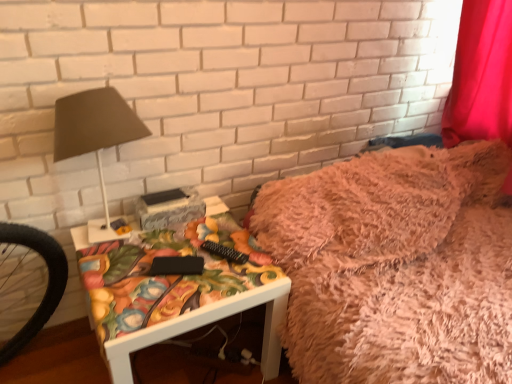
Question: Considering the relative positions of matte brown lampshade at left and fuzzy pink blanket at upper right in the image provided, is matte brown lampshade at left to the left of fuzzy pink blanket at upper right from the viewer's perspective?

Choices:
 (A) no
 (B) yes

Answer: (B)

Question: Considering the relative sizes of matte brown lampshade at left and fuzzy pink blanket at upper right in the image provided, is matte brown lampshade at left thinner than fuzzy pink blanket at upper right?

Choices:
 (A) no
 (B) yes

Answer: (B)

Question: Does matte brown lampshade at left appear on the right side of fuzzy pink blanket at upper right?

Choices:
 (A) yes
 (B) no

Answer: (B)

Question: Is matte brown lampshade at left shorter than fuzzy pink blanket at upper right?

Choices:
 (A) yes
 (B) no

Answer: (B)

Question: From a real-world perspective, is matte brown lampshade at left beneath fuzzy pink blanket at upper right?

Choices:
 (A) yes
 (B) no

Answer: (B)

Question: Does matte brown lampshade at left have a greater height compared to fuzzy pink blanket at upper right?

Choices:
 (A) yes
 (B) no

Answer: (A)

Question: Does matte floral-patterned side table at center have a lesser width compared to matte brown lampshade at left?

Choices:
 (A) no
 (B) yes

Answer: (A)

Question: From a real-world perspective, does matte floral-patterned side table at center stand above matte brown lampshade at left?

Choices:
 (A) no
 (B) yes

Answer: (A)

Question: Is matte floral-patterned side table at center aimed at matte brown lampshade at left?

Choices:
 (A) no
 (B) yes

Answer: (A)

Question: From the image's perspective, is matte floral-patterned side table at center below matte brown lampshade at left?

Choices:
 (A) no
 (B) yes

Answer: (B)

Question: Is matte brown lampshade at left inside matte floral-patterned side table at center?

Choices:
 (A) no
 (B) yes

Answer: (A)

Question: Can you confirm if matte floral-patterned side table at center is positioned to the left of matte brown lampshade at left?

Choices:
 (A) no
 (B) yes

Answer: (A)

Question: From a real-world perspective, is matte floral-patterned side table at center located higher than fuzzy pink blanket at upper right?

Choices:
 (A) yes
 (B) no

Answer: (B)